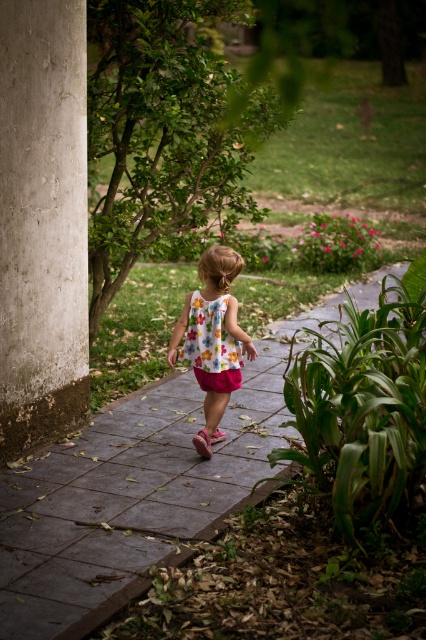
You are standing at the starting point and want to reach the point marked at coordinates (x=69, y=356). The path is 3 meters wide. Can you walk straight ahead without stepping off the path?

The point marked at coordinates (x=69, y=356) is 5.86 meters away from the viewer. Since the path is 3 meters wide, you can walk straight ahead without stepping off the path as the path width is sufficient for the distance.

You are standing at the camera position and want to determine which of the two points, point (5, 284) or point (215, 332), is nearer to you. Which point is closer?

Point (5, 284) is closer to the camera than point (215, 332).

You are a photographer trying to capture the child in the floral cotton dress at center without including the concrete pillar at left in the frame. Based on their positions, is this possible?

The concrete pillar at left is located above the floral cotton dress at center, so it is positioned higher up. Since the child is at the center, adjusting the camera angle downward might allow capturing the dress without the pillar in the frame.